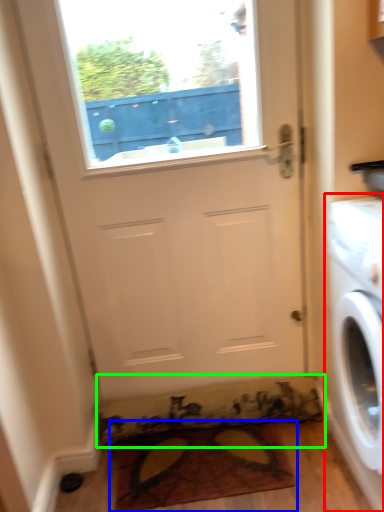
Question: Which is farther away from washing machine (highlighted by a red box)? doormat (highlighted by a blue box) or doormat (highlighted by a green box)?

Choices:
 (A) doormat
 (B) doormat

Answer: (B)